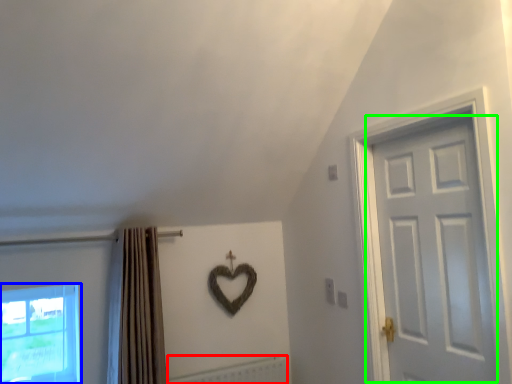
Question: Estimate the real-world distances between objects in this image. Which object is closer to radiator (highlighted by a red box), window (highlighted by a blue box) or door (highlighted by a green box)?

Choices:
 (A) window
 (B) door

Answer: (A)